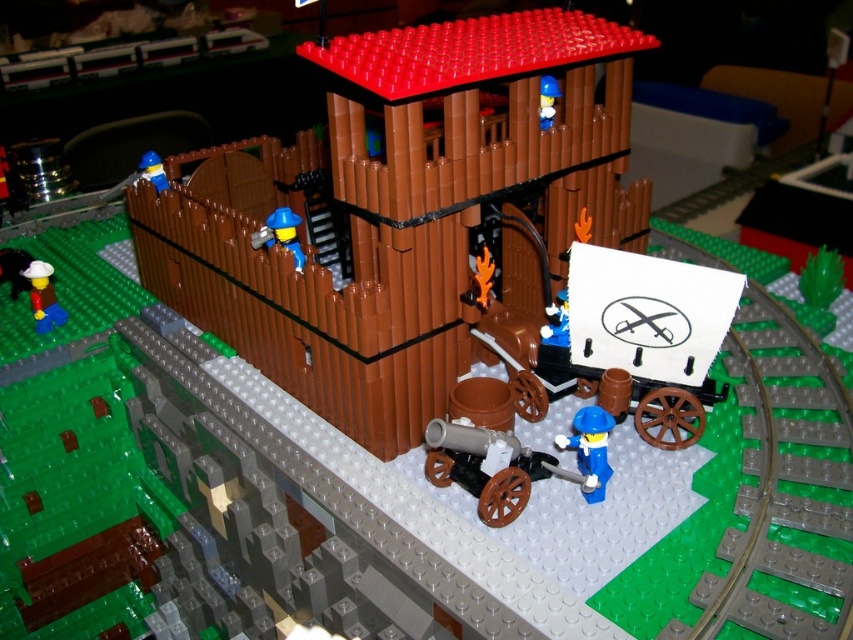
Who is positioned more to the left, blue plastic figure at lower right or blue plastic minifigure at upper left?

blue plastic minifigure at upper left

Is blue plastic figure at lower right to the left of blue plastic minifigure at upper left from the viewer's perspective?

In fact, blue plastic figure at lower right is to the right of blue plastic minifigure at upper left.

Does point (605, 417) lie behind point (166, 179)?

No, (605, 417) is in front of (166, 179).

At what (x,y) coordinates should I click in order to perform the action: click on blue plastic figure at lower right. Please return your answer as a coordinate pair (x, y). The height and width of the screenshot is (640, 853). Looking at the image, I should click on (589, 449).

Is point (300, 266) positioned behind point (543, 88)?

That is False.

Between point (265, 220) and point (543, 125), which one is positioned behind?

Positioned behind is point (265, 220).

Locate an element on the screen. The height and width of the screenshot is (640, 853). blue plastic minifigure at center is located at coordinates [280, 234].

Between blue plastic minifigure at center and blue plastic minifigure at upper left, which one is positioned lower?

Positioned lower is blue plastic minifigure at center.

Which is more to the left, blue plastic minifigure at center or blue plastic minifigure at upper left?

Positioned to the left is blue plastic minifigure at upper left.

The height and width of the screenshot is (640, 853). In order to click on blue plastic minifigure at center in this screenshot , I will do `click(280, 234)`.